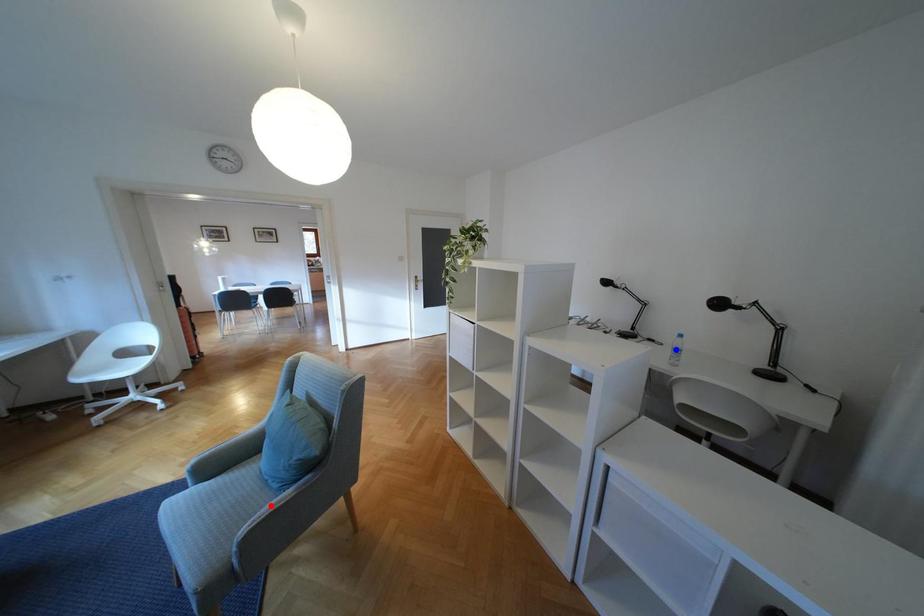
Question: In the image, two points are highlighted. Which point is nearer to the camera? Reply with the corresponding letter.

Choices:
 (A) blue point
 (B) red point

Answer: (B)